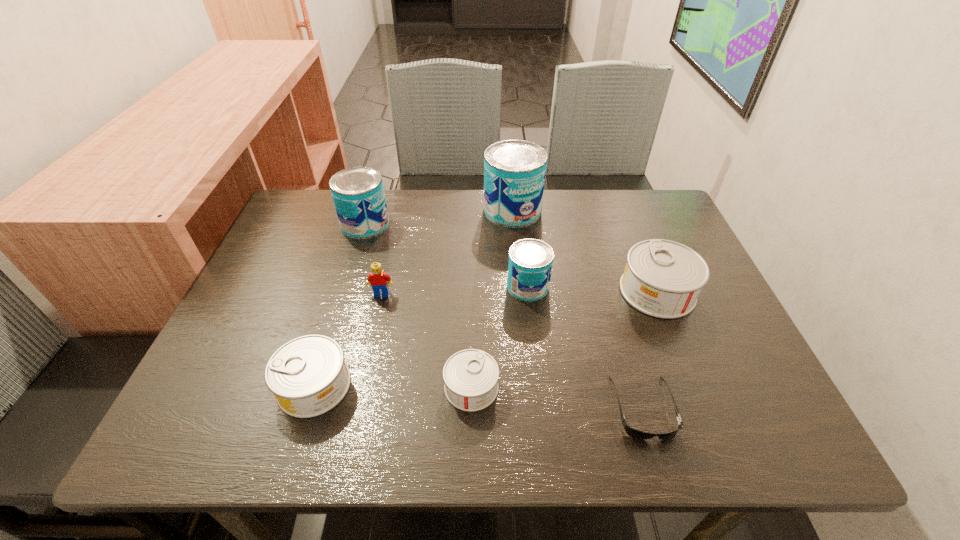
You are a GUI agent. You are given a task and a screenshot of the screen. Output one action in this format:
    pyautogui.click(x=<x>, y=<y>)
    Task: Click on the sunglasses at the near edge
    This screenshot has height=540, width=960.
    Given the screenshot: What is the action you would take?
    pyautogui.click(x=633, y=433)

The width and height of the screenshot is (960, 540). I want to click on object positioned at the left edge, so click(x=308, y=376).

Locate an element on the screen. object at the right edge is located at coordinates (663, 279).

Find the location of a particular element. object positioned at the near left corner is located at coordinates (x=308, y=376).

At what (x,y) coordinates should I click in order to perform the action: click on free space at the far edge. Please return your answer as a coordinate pair (x, y). Looking at the image, I should click on (398, 226).

The width and height of the screenshot is (960, 540). What are the coordinates of `free space at the near edge of the desktop` in the screenshot? It's located at (281, 426).

In the image, there is a desktop. At what (x,y) coordinates should I click in order to perform the action: click on vacant space at the left edge. Please return your answer as a coordinate pair (x, y). The height and width of the screenshot is (540, 960). Looking at the image, I should click on (277, 274).

At what (x,y) coordinates should I click in order to perform the action: click on vacant area at the right edge. Please return your answer as a coordinate pair (x, y). The height and width of the screenshot is (540, 960). Looking at the image, I should click on (716, 367).

The image size is (960, 540). I want to click on free space at the far left corner of the desktop, so click(x=331, y=209).

The image size is (960, 540). I want to click on vacant space at the far right corner of the desktop, so click(627, 204).